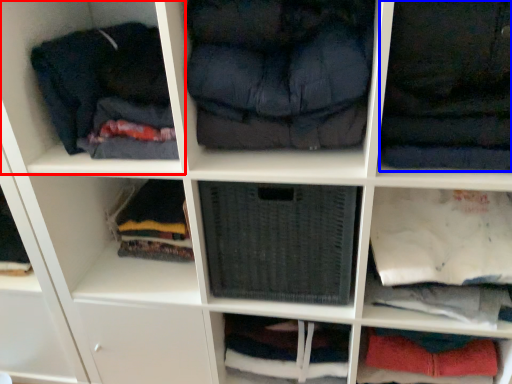
Question: Which object appears closest to the camera in this image, shelf (highlighted by a red box) or clothing (highlighted by a blue box)?

Choices:
 (A) shelf
 (B) clothing

Answer: (B)